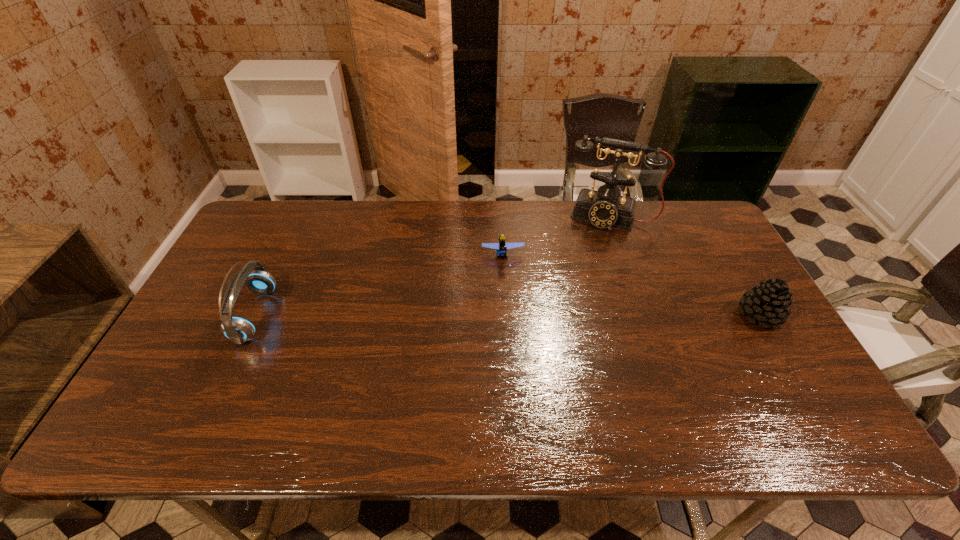
Where is `vacant space on the desktop that is between the headset and the rightmost object and is positioned on the front-facing side of the third nearest object`? vacant space on the desktop that is between the headset and the rightmost object and is positioned on the front-facing side of the third nearest object is located at coordinates (508, 315).

Where is `free space on the desktop that is between the second tallest object and the second shortest object and is positioned on the dial of the farthest object`? free space on the desktop that is between the second tallest object and the second shortest object and is positioned on the dial of the farthest object is located at coordinates point(580,315).